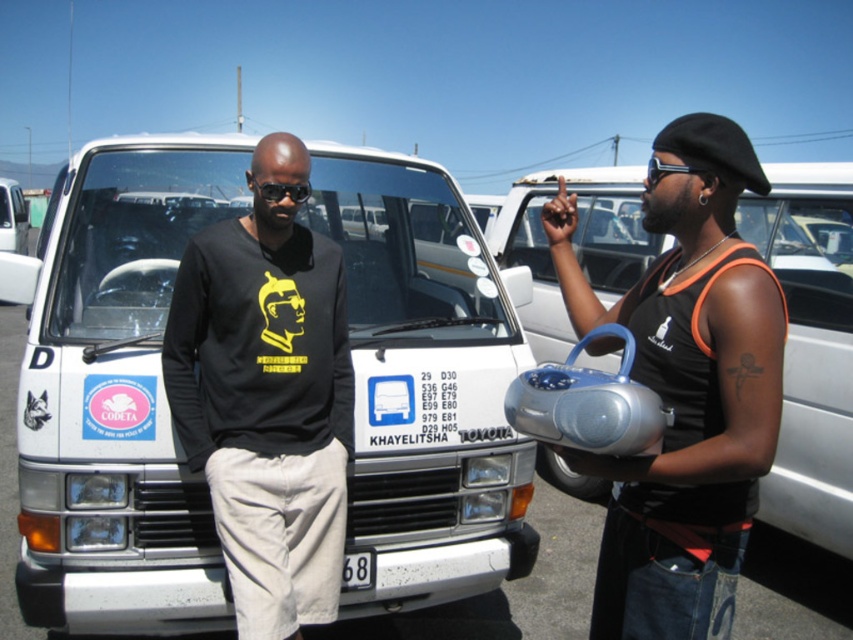
Question: Which point is closer to the camera?

Choices:
 (A) (347, 570)
 (B) (287, 188)
 (C) (648, 180)
 (D) (698, 225)

Answer: (D)

Question: Can you confirm if white matte van at center is positioned below black matte shirt at center?

Choices:
 (A) no
 (B) yes

Answer: (A)

Question: Which point is farther from the camera taking this photo?

Choices:
 (A) (351, 304)
 (B) (659, 563)
 (C) (688, 172)
 (D) (300, 196)

Answer: (A)

Question: Can you confirm if black matte shirt at center is positioned below black plastic sunglasses at upper center?

Choices:
 (A) no
 (B) yes

Answer: (B)

Question: Estimate the real-world distances between objects in this image. Which object is farther from the metallic silver boombox at right?

Choices:
 (A) black plastic sunglasses at center
 (B) white matte van at center

Answer: (B)

Question: Can you confirm if white matte van at center is positioned to the right of white plastic license plate at center?

Choices:
 (A) no
 (B) yes

Answer: (A)